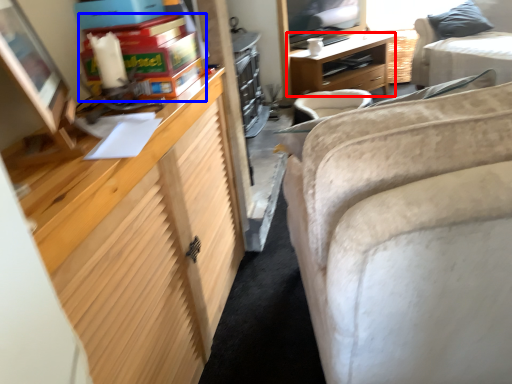
Question: Which object appears closest to the camera in this image, desk (highlighted by a red box) or toy (highlighted by a blue box)?

Choices:
 (A) desk
 (B) toy

Answer: (B)